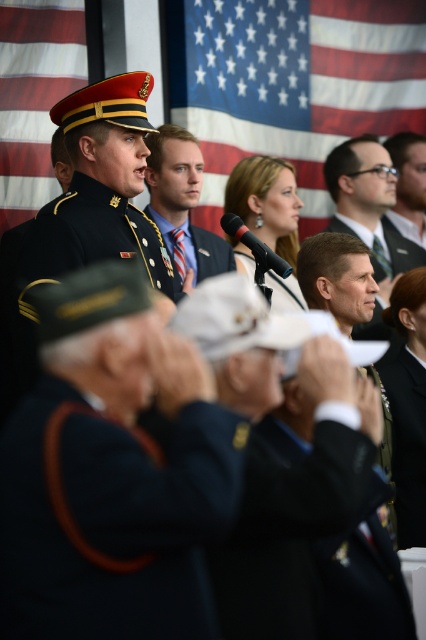
Between red flag at left and matte black suit at center, which one appears on the right side from the viewer's perspective?

Positioned to the right is matte black suit at center.

Can you confirm if red flag at left is positioned to the left of matte black suit at center?

Yes, red flag at left is to the left of matte black suit at center.

The height and width of the screenshot is (640, 426). Find the location of `red flag at left`. red flag at left is located at coordinates (34, 96).

Looking at this image, can you confirm if red flag at left is shorter than shiny gold buttons at center?

In fact, red flag at left may be taller than shiny gold buttons at center.

Is red flag at left below shiny gold buttons at center?

No.

Is point (2, 19) closer to camera compared to point (425, 486)?

No, (2, 19) is further to viewer.

At what (x,y) coordinates should I click in order to perform the action: click on red flag at left. Please return your answer as a coordinate pair (x, y). The image size is (426, 640). Looking at the image, I should click on (34, 96).

Does american flag at upper center have a larger size compared to black fabric suit at center?

Actually, american flag at upper center might be smaller than black fabric suit at center.

Between point (270, 1) and point (370, 550), which one is positioned in front?

Point (370, 550) is more forward.

Find the location of `american flag at upper center`. american flag at upper center is located at coordinates (291, 83).